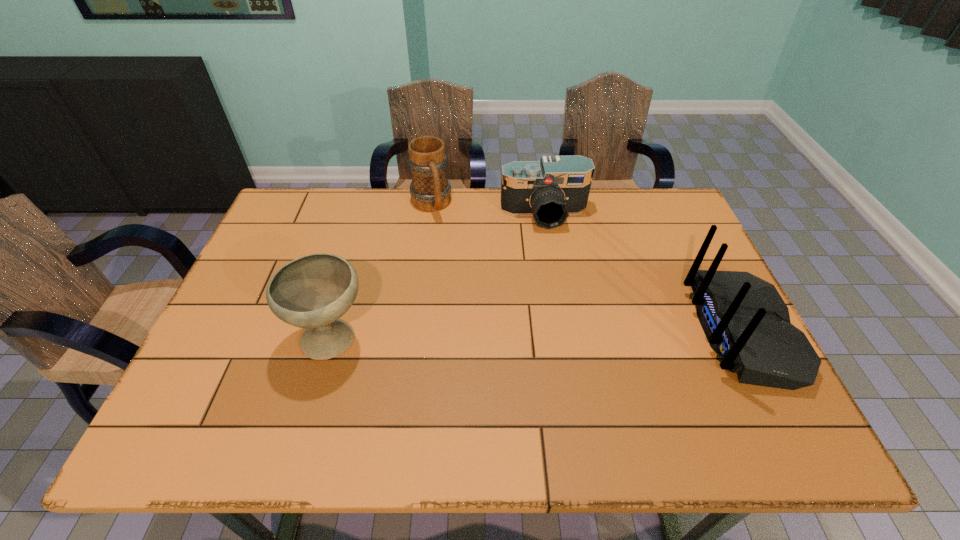
I want to click on vacant region that satisfies the following two spatial constraints: 1. on the front side of the third object from right to left; 2. on the right side of the third object from left to right, so click(429, 214).

This screenshot has height=540, width=960. In order to click on free point that satisfies the following two spatial constraints: 1. on the front side of the router; 2. on the back of the second object from right to left in this screenshot , I will do `click(563, 331)`.

Find the location of a particular element. The image size is (960, 540). free space that satisfies the following two spatial constraints: 1. on the front side of the router; 2. on the back of the mug is located at coordinates (415, 331).